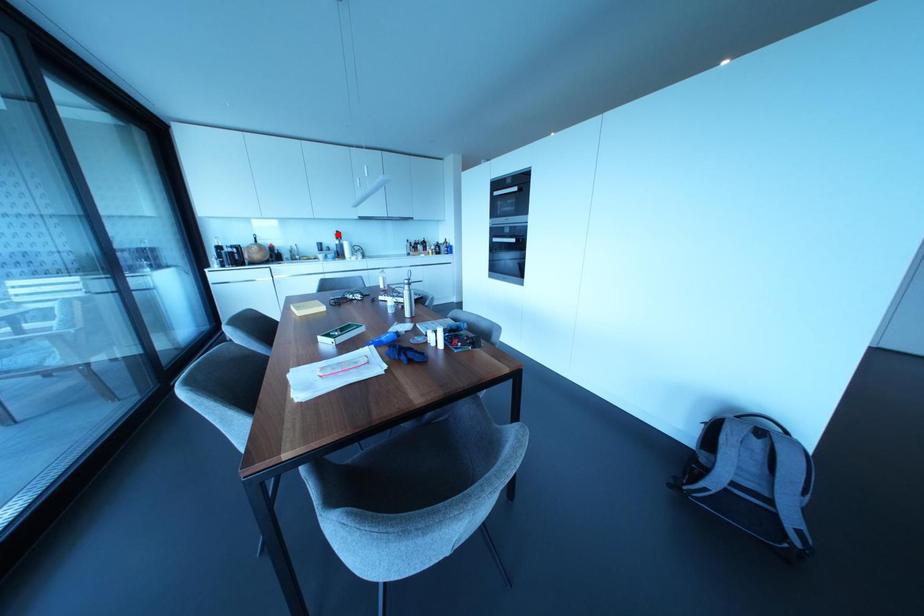
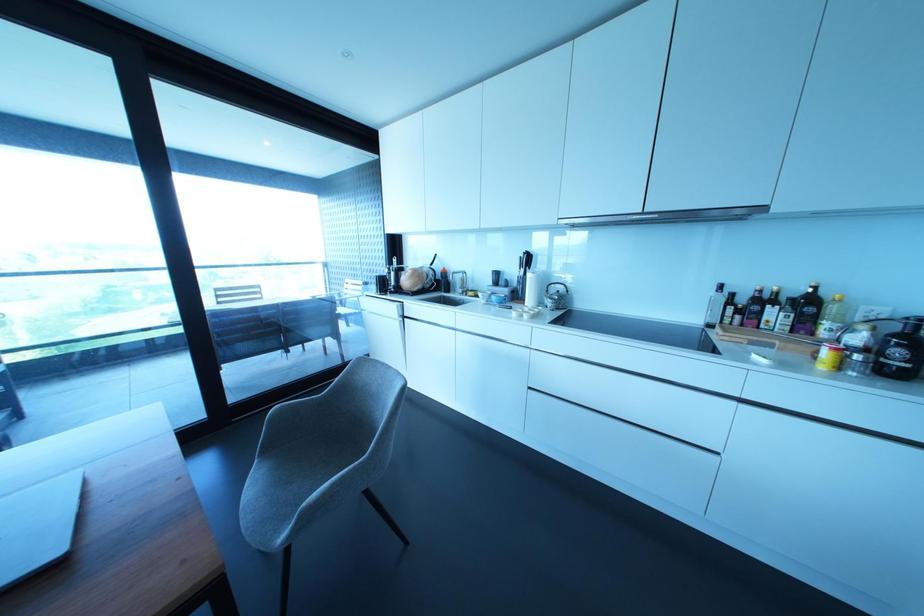
In the second image, find the point that corresponds to the highlighted location in the first image.

(527, 259)